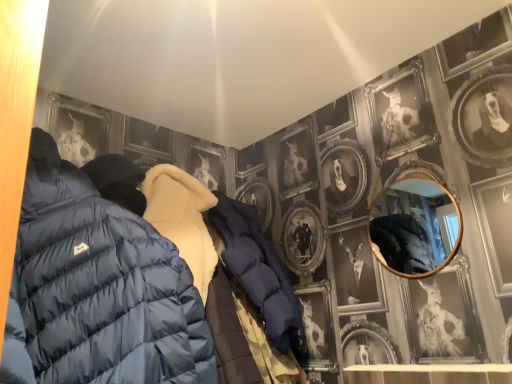
Image resolution: width=512 pixels, height=384 pixels. What do you see at coordinates (97, 289) in the screenshot? I see `matte blue puffer jacket at left` at bounding box center [97, 289].

The height and width of the screenshot is (384, 512). What are the coordinates of `matte blue puffer jacket at left` in the screenshot? It's located at (97, 289).

In order to face gold-framed mirror at upper right, should I rotate leftwards or rightwards?

You should look right and rotate roughly 19.997 degrees.

Where is `gold-framed mirror at upper right`? The height and width of the screenshot is (384, 512). gold-framed mirror at upper right is located at coordinates (415, 228).

Describe the element at coordinates (415, 228) in the screenshot. I see `gold-framed mirror at upper right` at that location.

The height and width of the screenshot is (384, 512). In order to click on matte blue puffer jacket at left in this screenshot , I will do `click(97, 289)`.

Visually, is matte blue puffer jacket at left positioned to the left or to the right of gold-framed mirror at upper right?

From the image, it's evident that matte blue puffer jacket at left is to the left of gold-framed mirror at upper right.

Looking at this image, does matte blue puffer jacket at left come in front of gold-framed mirror at upper right?

Yes, matte blue puffer jacket at left is in front of gold-framed mirror at upper right.

Which point is more distant from viewer, (69, 237) or (387, 230)?

The point (387, 230) is behind.

From the image's perspective, is matte blue puffer jacket at left under gold-framed mirror at upper right?

Indeed, from the image's perspective, matte blue puffer jacket at left is shown beneath gold-framed mirror at upper right.

In the scene shown: From a real-world perspective, is matte blue puffer jacket at left positioned above or below gold-framed mirror at upper right?

Clearly, from a real-world perspective, matte blue puffer jacket at left is below gold-framed mirror at upper right.

Is matte blue puffer jacket at left thinner than gold-framed mirror at upper right?

In fact, matte blue puffer jacket at left might be wider than gold-framed mirror at upper right.

Which of these two, matte blue puffer jacket at left or gold-framed mirror at upper right, stands taller?

matte blue puffer jacket at left is taller.

Looking at the image, does matte blue puffer jacket at left seem bigger or smaller compared to gold-framed mirror at upper right?

matte blue puffer jacket at left is bigger than gold-framed mirror at upper right.

Is matte blue puffer jacket at left located outside gold-framed mirror at upper right?

That's correct, matte blue puffer jacket at left is outside of gold-framed mirror at upper right.

Are matte blue puffer jacket at left and gold-framed mirror at upper right far apart?

Yes, matte blue puffer jacket at left and gold-framed mirror at upper right are located far from each other.

Is matte blue puffer jacket at left facing towards gold-framed mirror at upper right?

No, matte blue puffer jacket at left is not aimed at gold-framed mirror at upper right.

What's the angular difference between matte blue puffer jacket at left and gold-framed mirror at upper right's facing directions?

90.6 degrees separate the facing orientations of matte blue puffer jacket at left and gold-framed mirror at upper right.

Image resolution: width=512 pixels, height=384 pixels. In order to click on jacket directly beneath the gold-framed mirror at upper right (from a real-world perspective) in this screenshot , I will do `click(97, 289)`.

Which is more to the right, gold-framed mirror at upper right or matte blue puffer jacket at left?

gold-framed mirror at upper right.

Which object is closer to the camera taking this photo, gold-framed mirror at upper right or matte blue puffer jacket at left?

matte blue puffer jacket at left is in front.

Which point is more distant from viewer, (x=426, y=261) or (x=153, y=333)?

Point (x=426, y=261)

From the image's perspective, between gold-framed mirror at upper right and matte blue puffer jacket at left, who is located below?

From the image's view, matte blue puffer jacket at left is below.

From a real-world perspective, between gold-framed mirror at upper right and matte blue puffer jacket at left, who is vertically lower?

matte blue puffer jacket at left.

Considering the relative sizes of gold-framed mirror at upper right and matte blue puffer jacket at left in the image provided, is gold-framed mirror at upper right thinner than matte blue puffer jacket at left?

Yes, gold-framed mirror at upper right is thinner than matte blue puffer jacket at left.

Considering the sizes of objects gold-framed mirror at upper right and matte blue puffer jacket at left in the image provided, who is shorter, gold-framed mirror at upper right or matte blue puffer jacket at left?

gold-framed mirror at upper right is shorter.

Can you confirm if gold-framed mirror at upper right is bigger than matte blue puffer jacket at left?

No.

Is matte blue puffer jacket at left inside gold-framed mirror at upper right?

Definitely not — matte blue puffer jacket at left is not inside gold-framed mirror at upper right.

Is gold-framed mirror at upper right touching matte blue puffer jacket at left?

No, gold-framed mirror at upper right is not beside matte blue puffer jacket at left.

Is gold-framed mirror at upper right facing away from matte blue puffer jacket at left?

That's not correct — gold-framed mirror at upper right is not looking away from matte blue puffer jacket at left.

Find the location of `jacket located underneath the gold-framed mirror at upper right (from a real-world perspective)`. jacket located underneath the gold-framed mirror at upper right (from a real-world perspective) is located at coordinates (97, 289).

Find the location of a particular element. This screenshot has height=384, width=512. jacket that is in front of the gold-framed mirror at upper right is located at coordinates (97, 289).

Locate an element on the screen. The image size is (512, 384). jacket located underneath the gold-framed mirror at upper right (from a real-world perspective) is located at coordinates (97, 289).